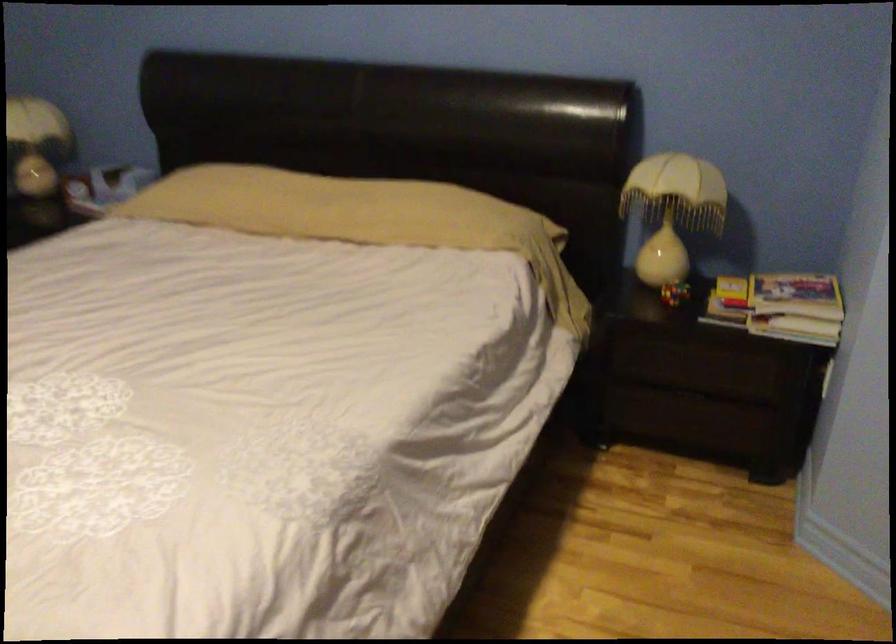
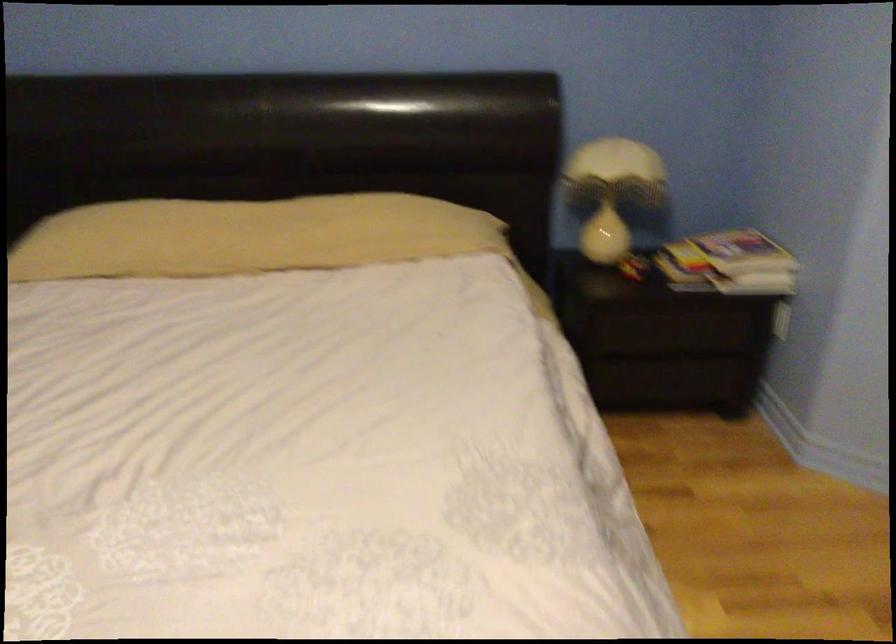
Question: The camera is either moving clockwise (left) or counter-clockwise (right) around the object. The first image is from the beginning of the video and the second image is from the end. Is the camera moving left or right when shooting the video?

Choices:
 (A) Left
 (B) Right

Answer: (A)